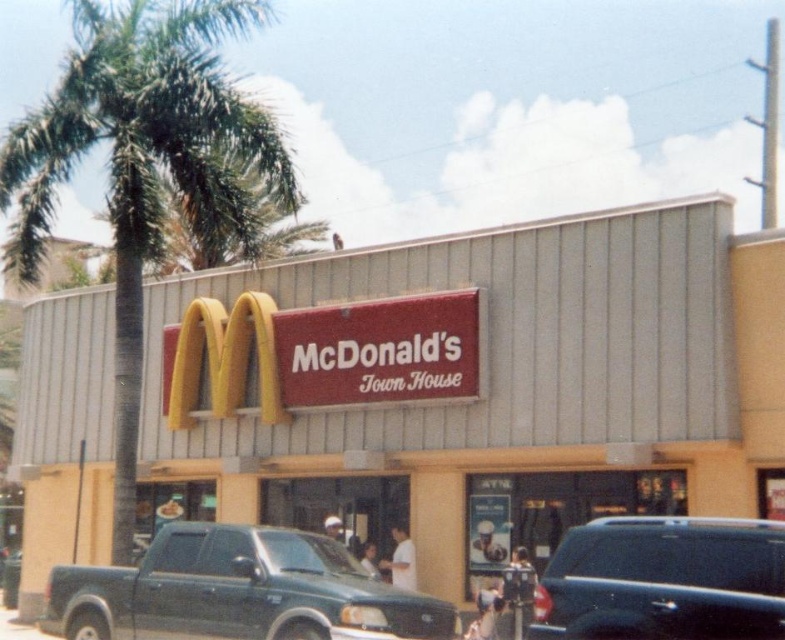
You are standing in front of the McDonald Town House restaurant. You see a red signboard at center and a green leafy palm tree at left. Which object is closer to the ground?

The red signboard at center is below the green leafy palm tree at left, so the red signboard at center is closer to the ground.

You are standing at the entrance of the McDonalds Town House restaurant and want to take a photo of the green leafy palm tree at left. Which direction should you face to capture it in your shot?

The green leafy palm tree at left is located at point [144,164], which is to the left side of the entrance. Therefore, you should face towards the left direction to capture the palm tree in your photo.

Consider the image. You are a customer arriving at the McDonald Town House restaurant. You see the green matte truck at lower left and the shiny black suv at lower right. Which vehicle is closer to the entrance of the restaurant?

The green matte truck at lower left is closer to the entrance of the restaurant because the shiny black suv at lower right is behind it.